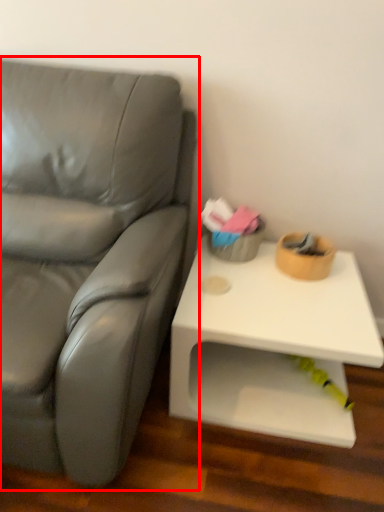
Question: Observing the image, what is the correct spatial positioning of studio couch (annotated by the red box) in reference to table?

Choices:
 (A) right
 (B) left

Answer: (B)